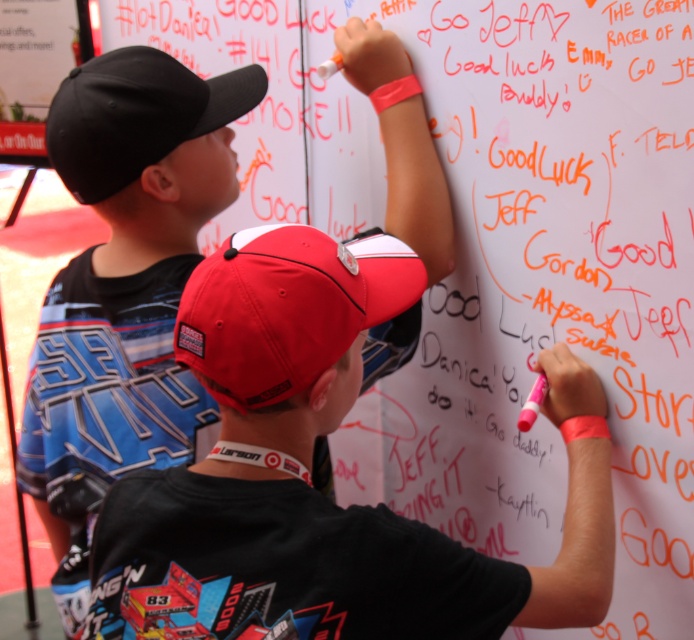
You are a photographer standing in front of the whiteboard. You want to take a photo of both the black matte cap at upper left and the shiny red baseball cap at center. Which cap should you adjust your camera focus on first to ensure both are in clear view?

The black matte cap at upper left is closer to you than the shiny red baseball cap at center, so focus on the black matte cap at upper left first to ensure both are in clear view.

You are standing at the point marked as point (203, 211) in the scene. The two children are writing on the whiteboard. How far apart are the two children?

The two children are 4.17 feet apart.